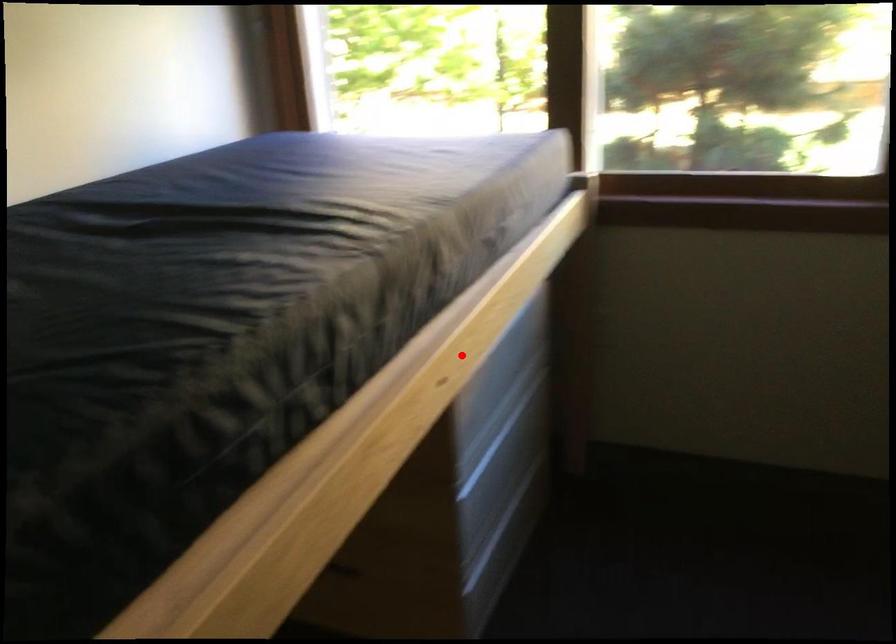
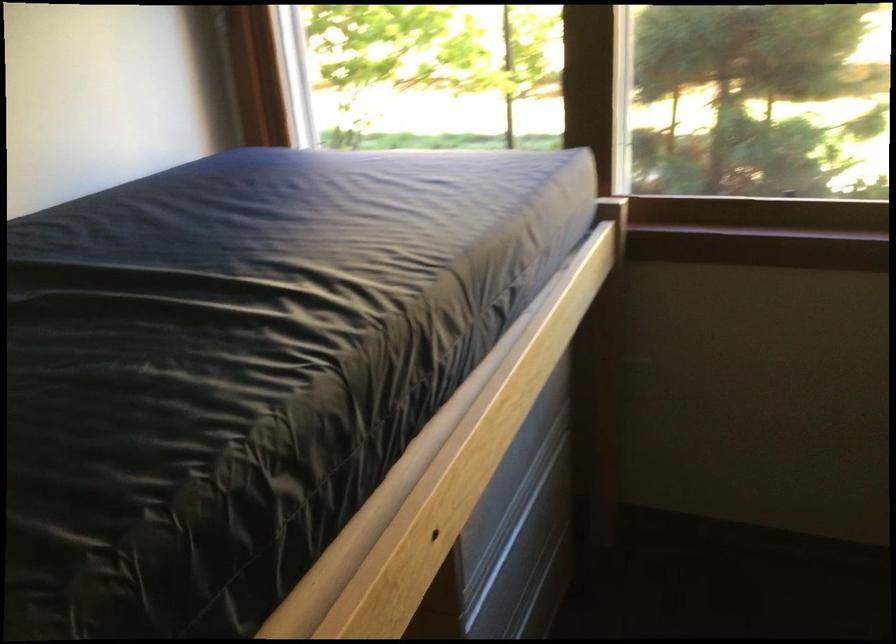
Question: I am providing you with two images of the same scene from different viewpoints. A red point is shown in image1. For the corresponding object point in image2, is it positioned nearer or farther from the camera?

Choices:
 (A) Nearer
 (B) Farther

Answer: (A)